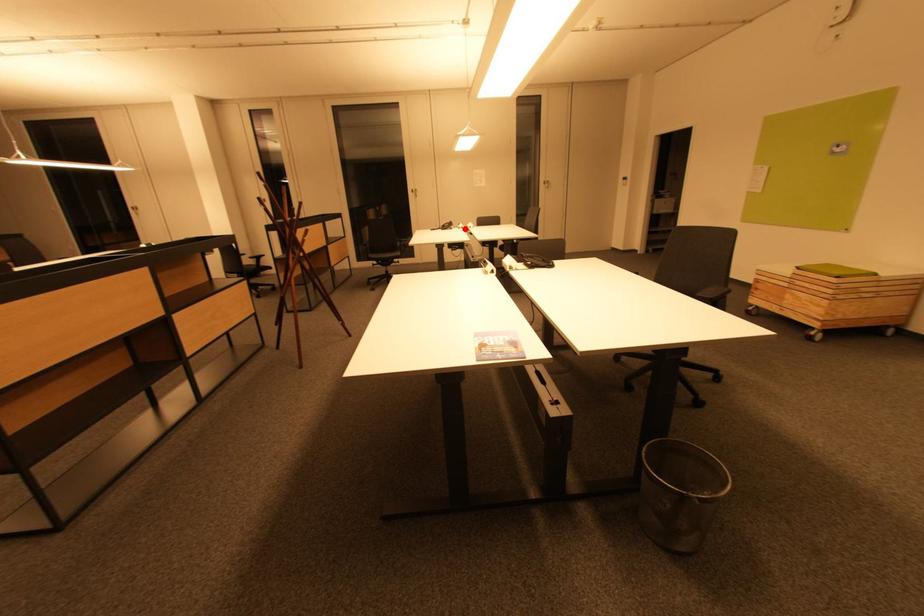
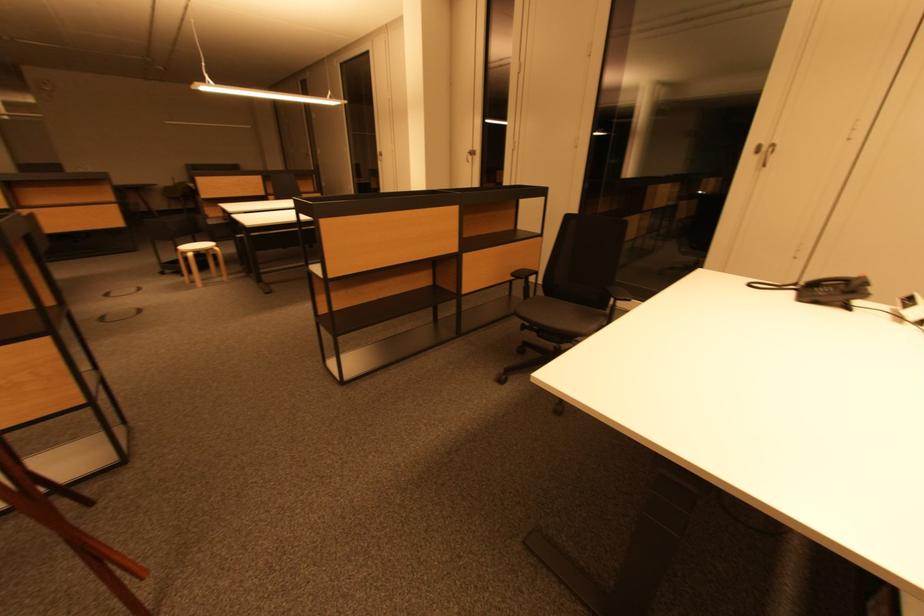
Question: I am providing you with two images of the same scene from different viewpoints. In image1, a red point is highlighted. Considering the same 3D point in image2, which of the following is correct?

Choices:
 (A) It is closer
 (B) It is farther

Answer: (B)